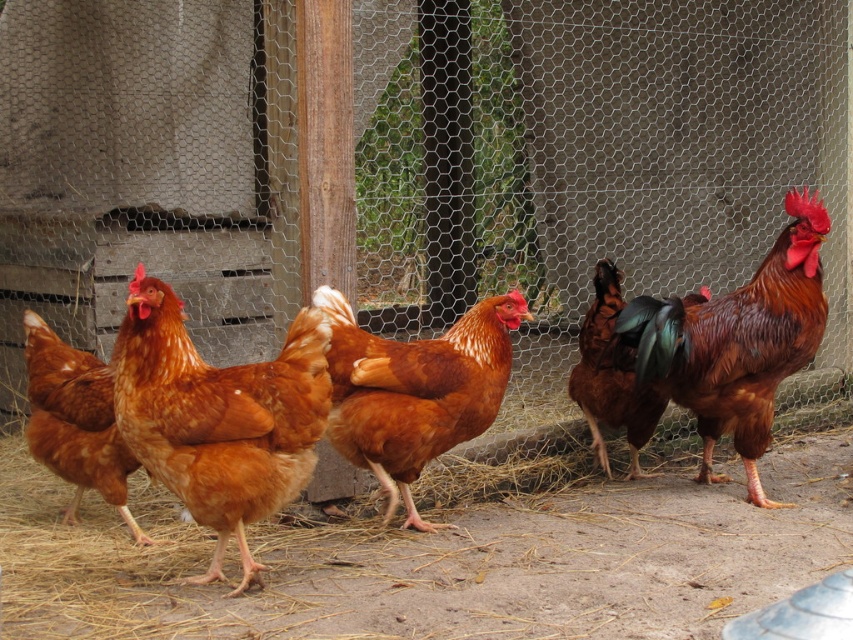
Question: From the image, what is the correct spatial relationship of brown glossy rooster at right in relation to brown glossy chicken at center?

Choices:
 (A) left
 (B) right

Answer: (B)

Question: Which of these objects is positioned closest to the brown matte chicken at center?

Choices:
 (A) brown feathered chicken at left
 (B) matte brown chicken at center
 (C) brown glossy rooster at right

Answer: (B)

Question: Can you confirm if brown matte chicken at center is wider than brown feathered chicken at left?

Choices:
 (A) yes
 (B) no

Answer: (A)

Question: Which point is farther to the camera?

Choices:
 (A) (807, 301)
 (B) (239, 556)

Answer: (A)

Question: Observing the image, what is the correct spatial positioning of brown glossy rooster at right in reference to brown glossy chicken at center?

Choices:
 (A) left
 (B) right

Answer: (B)

Question: Which point is closer to the camera?

Choices:
 (A) brown glossy chicken at center
 (B) matte brown chicken at center
 (C) brown glossy rooster at right

Answer: (B)